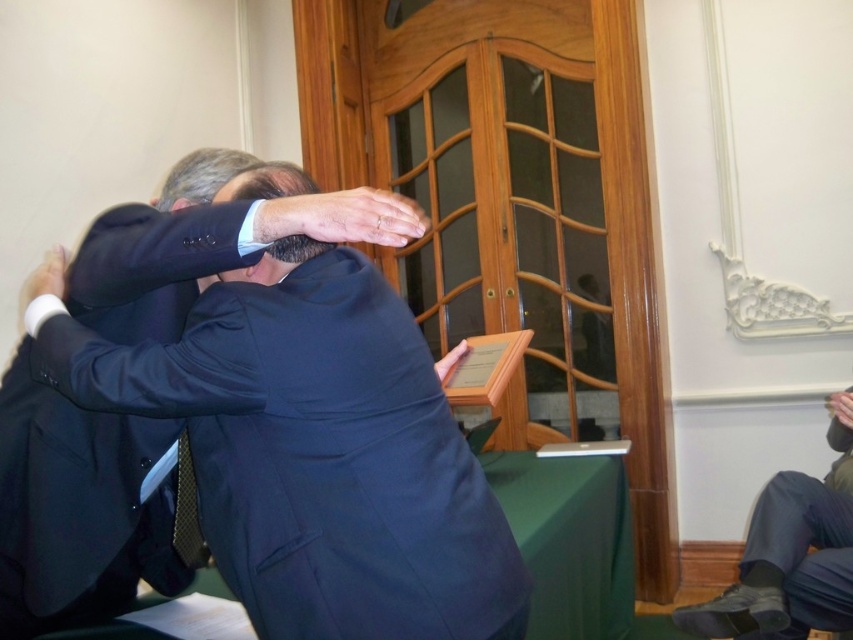
Based on the photo, is matte black head at center below smooth dark hair at center?

Correct, matte black head at center is located below smooth dark hair at center.

Between matte black head at center and smooth dark hair at center, which one has less height?

Standing shorter between the two is smooth dark hair at center.

Where is `matte black head at center`? matte black head at center is located at coordinates (270, 182).

From the picture: Is matte black head at center to the left of black textured tie at center from the viewer's perspective?

No, matte black head at center is not to the left of black textured tie at center.

Which is more to the right, matte black head at center or black textured tie at center?

Positioned to the right is matte black head at center.

The height and width of the screenshot is (640, 853). What do you see at coordinates (270, 182) in the screenshot?
I see `matte black head at center` at bounding box center [270, 182].

At what (x,y) coordinates should I click in order to perform the action: click on matte black head at center. Please return your answer as a coordinate pair (x, y). Looking at the image, I should click on (270, 182).

The width and height of the screenshot is (853, 640). Describe the element at coordinates (312, 449) in the screenshot. I see `matte black suit at center` at that location.

Is matte black suit at center positioned at the back of black textured tie at center?

Result: No, matte black suit at center is in front of black textured tie at center.

Who is more forward, [332,349] or [177,540]?

Point [332,349] is in front.

Identify the location of matte black suit at center. (312, 449).